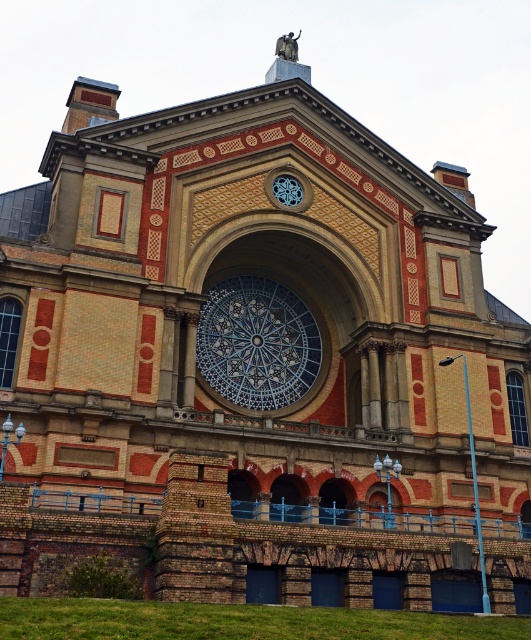
Question: Is blue stained glass window at center to the right of matte metal clock at upper center from the viewer's perspective?

Choices:
 (A) yes
 (B) no

Answer: (B)

Question: Is blue stained glass window at center positioned in front of matte metal clock at upper center?

Choices:
 (A) yes
 (B) no

Answer: (A)

Question: Which point is farther to the camera?

Choices:
 (A) (280, 184)
 (B) (253, 401)

Answer: (A)

Question: Which point is farther to the camera?

Choices:
 (A) (284, 348)
 (B) (290, 186)

Answer: (A)

Question: Is blue stained glass window at center thinner than matte metal clock at upper center?

Choices:
 (A) yes
 (B) no

Answer: (B)